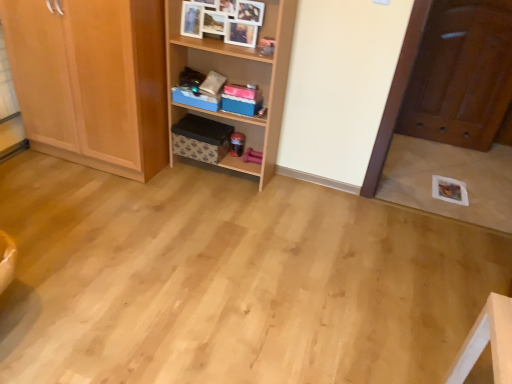
This screenshot has height=384, width=512. Find the location of `free location above blue fabric storage box at center (from a real-world perspective)`. free location above blue fabric storage box at center (from a real-world perspective) is located at coordinates (201, 86).